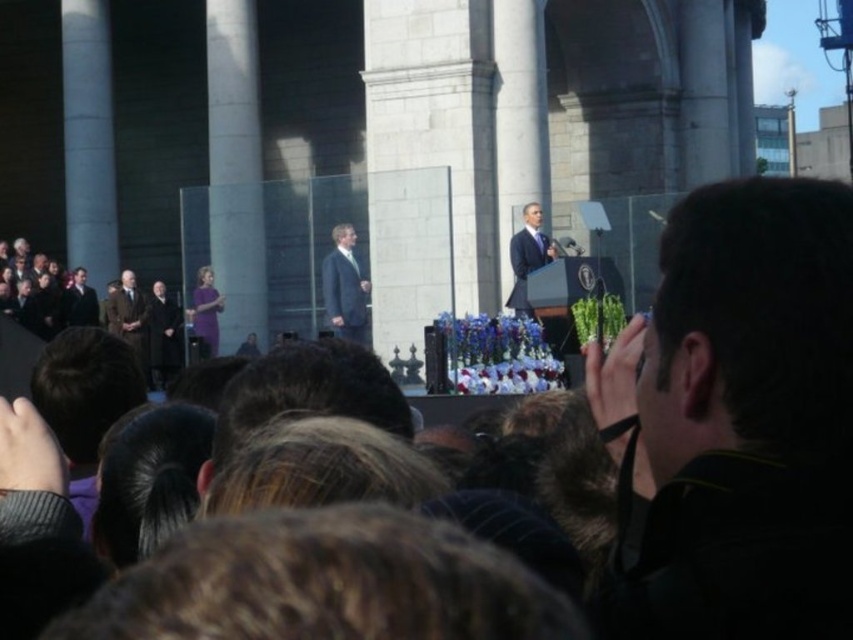
Is point (541, 259) less distant than point (206, 323)?

That is True.

Image resolution: width=853 pixels, height=640 pixels. What do you see at coordinates (527, 257) in the screenshot? I see `dark suit at center` at bounding box center [527, 257].

Between point (537, 266) and point (219, 296), which one is positioned in front?

Positioned in front is point (537, 266).

Find the location of `dark suit at center`. dark suit at center is located at coordinates (527, 257).

Is point (538, 216) farther from viewer compared to point (141, 368)?

Yes, it is.

Is point (515, 280) farther from viewer compared to point (117, 304)?

No, (515, 280) is in front of (117, 304).

The width and height of the screenshot is (853, 640). In order to click on dark suit at center in this screenshot , I will do `click(527, 257)`.

Is point (836, 189) more distant than point (195, 307)?

That is False.

Find the location of a particular element. black fabric camera at right is located at coordinates (746, 420).